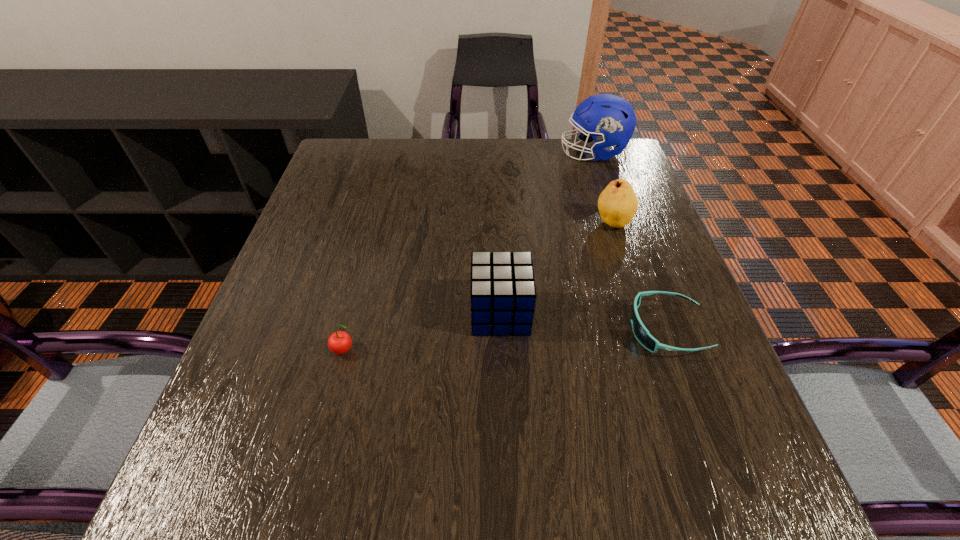
Image resolution: width=960 pixels, height=540 pixels. I want to click on free spot located 0.360m on the left of the fourth nearest object, so click(x=448, y=222).

The height and width of the screenshot is (540, 960). Identify the location of vacant space located 0.260m on the front of the cube. (507, 477).

Where is `vacant region located on the front of the cherry`? vacant region located on the front of the cherry is located at coordinates [x=326, y=421].

The width and height of the screenshot is (960, 540). I want to click on vacant space located on the front-facing side of the shortest object, so click(422, 329).

What are the coordinates of `free region located 0.240m on the front-facing side of the shortest object` in the screenshot? It's located at (504, 329).

I want to click on vacant space located 0.130m on the front-facing side of the shortest object, so click(562, 329).

You are a GUI agent. You are given a task and a screenshot of the screen. Output one action in this format:
    pyautogui.click(x=<x>, y=<y>)
    Task: Click on the object that is at the far edge
    The height and width of the screenshot is (540, 960).
    Given the screenshot: What is the action you would take?
    pyautogui.click(x=611, y=120)

Identify the location of object that is positioned at the left edge. The image size is (960, 540). (339, 342).

The height and width of the screenshot is (540, 960). Find the location of `football helmet that is at the right edge`. football helmet that is at the right edge is located at coordinates (611, 120).

Identify the location of pear positioned at the right edge. (617, 204).